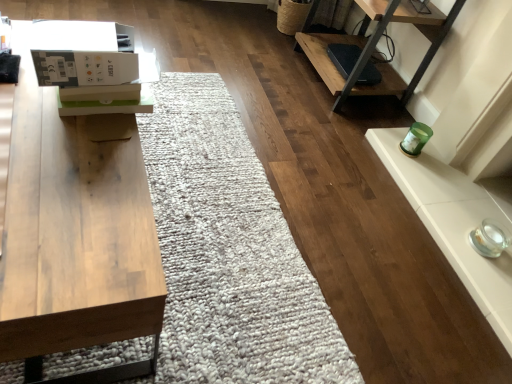
Where is `free point above wooden table at left (from a real-world perspective)`? Image resolution: width=512 pixels, height=384 pixels. free point above wooden table at left (from a real-world perspective) is located at coordinates (59, 159).